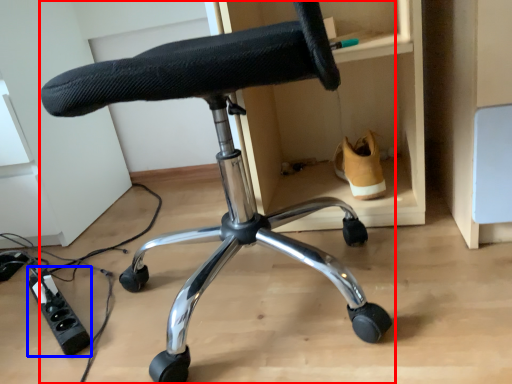
Question: Which object appears closest to the camera in this image, chair (highlighted by a red box) or plug (highlighted by a blue box)?

Choices:
 (A) chair
 (B) plug

Answer: (A)